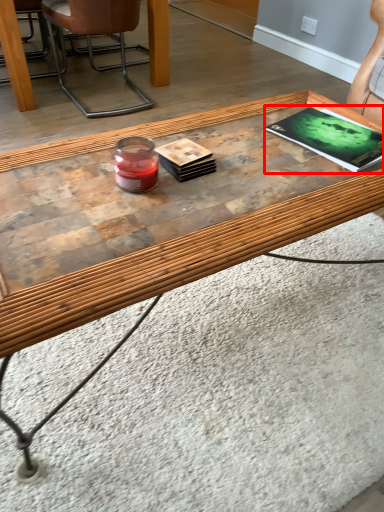
Question: Considering the relative positions of magazine (annotated by the red box) and chair in the image provided, where is magazine (annotated by the red box) located with respect to the staircase?

Choices:
 (A) right
 (B) left

Answer: (A)